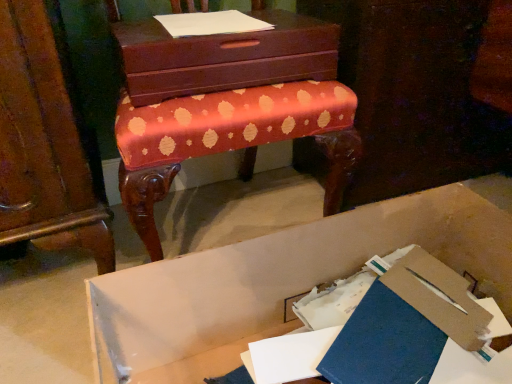
Question: Is there a large distance between white paper at upper center and matte brown chest of drawers at upper center?

Choices:
 (A) no
 (B) yes

Answer: (A)

Question: From a real-world perspective, does white paper at upper center stand above matte brown chest of drawers at upper center?

Choices:
 (A) yes
 (B) no

Answer: (A)

Question: Considering the relative sizes of white paper at upper center and matte brown chest of drawers at upper center in the image provided, is white paper at upper center smaller than matte brown chest of drawers at upper center?

Choices:
 (A) no
 (B) yes

Answer: (B)

Question: Considering the relative sizes of white paper at upper center and matte brown chest of drawers at upper center in the image provided, is white paper at upper center wider than matte brown chest of drawers at upper center?

Choices:
 (A) no
 (B) yes

Answer: (A)

Question: Is white paper at upper center positioned in front of matte brown chest of drawers at upper center?

Choices:
 (A) no
 (B) yes

Answer: (A)

Question: Considering the positions of matte brown chest of drawers at upper center and white paper at upper center in the image, is matte brown chest of drawers at upper center taller or shorter than white paper at upper center?

Choices:
 (A) tall
 (B) short

Answer: (A)

Question: Is matte brown chest of drawers at upper center inside the boundaries of white paper at upper center, or outside?

Choices:
 (A) outside
 (B) inside

Answer: (A)

Question: Is matte brown chest of drawers at upper center wider or thinner than white paper at upper center?

Choices:
 (A) wide
 (B) thin

Answer: (A)

Question: Visually, is matte brown chest of drawers at upper center positioned to the left or to the right of white paper at upper center?

Choices:
 (A) left
 (B) right

Answer: (B)

Question: In terms of size, does blue matte paper at lower center appear bigger or smaller than white paper at upper center?

Choices:
 (A) small
 (B) big

Answer: (B)

Question: In the image, is blue matte paper at lower center positioned in front of or behind white paper at upper center?

Choices:
 (A) behind
 (B) front

Answer: (B)

Question: Do you think blue matte paper at lower center is within white paper at upper center, or outside of it?

Choices:
 (A) outside
 (B) inside

Answer: (A)

Question: Does point (476, 326) appear closer or farther from the camera than point (262, 21)?

Choices:
 (A) farther
 (B) closer

Answer: (B)

Question: From the image's perspective, is blue matte paper at lower center above or below white cardboard box at lower center?

Choices:
 (A) above
 (B) below

Answer: (A)

Question: In terms of size, does blue matte paper at lower center appear bigger or smaller than white cardboard box at lower center?

Choices:
 (A) big
 (B) small

Answer: (B)